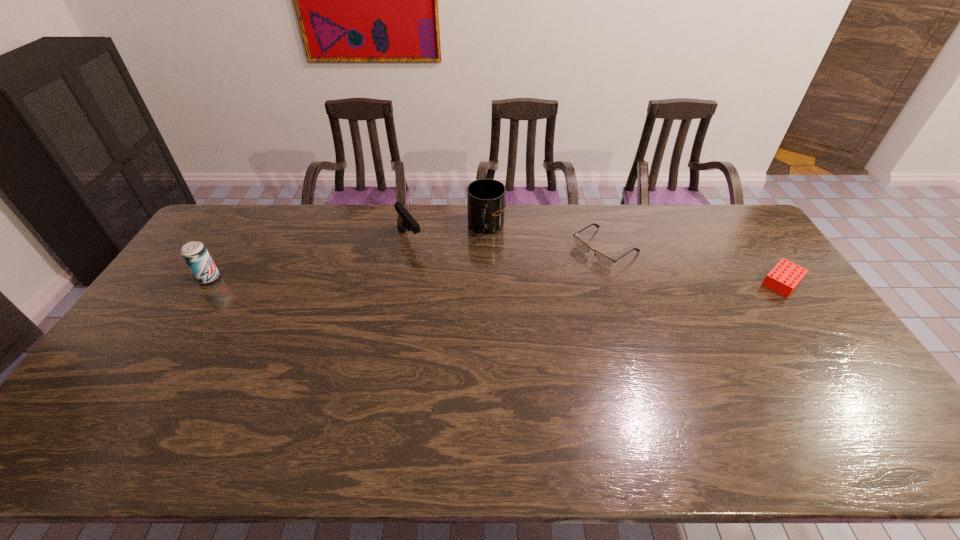
Find the location of a particular element. This screenshot has height=540, width=960. vacant space located 0.200m on the front-facing side of the pistol is located at coordinates (443, 286).

What are the coordinates of `free space located 0.150m on the front-facing side of the spectacles` in the screenshot? It's located at (553, 282).

I want to click on free space located on the front-facing side of the spectacles, so click(541, 289).

Locate an element on the screen. This screenshot has height=540, width=960. vacant space located on the front-facing side of the spectacles is located at coordinates (557, 280).

Where is `vacant position located with the handle on the side of the third object from left to right`? Image resolution: width=960 pixels, height=540 pixels. vacant position located with the handle on the side of the third object from left to right is located at coordinates (473, 252).

Find the location of a particular element. Image resolution: width=960 pixels, height=540 pixels. blank area located with the handle on the side of the third object from left to right is located at coordinates (471, 256).

You are a GUI agent. You are given a task and a screenshot of the screen. Output one action in this format:
    pyautogui.click(x=<x>, y=<y>)
    Task: Click on the free location located 0.170m with the handle on the side of the third object from left to right
    
    Given the screenshot: What is the action you would take?
    [x=461, y=273]

What are the coordinates of `pistol that is at the far edge` in the screenshot? It's located at (405, 221).

Locate an element on the screen. Image resolution: width=960 pixels, height=540 pixels. spectacles situated at the far edge is located at coordinates (579, 244).

Where is `mug present at the far edge`? This screenshot has height=540, width=960. mug present at the far edge is located at coordinates (486, 203).